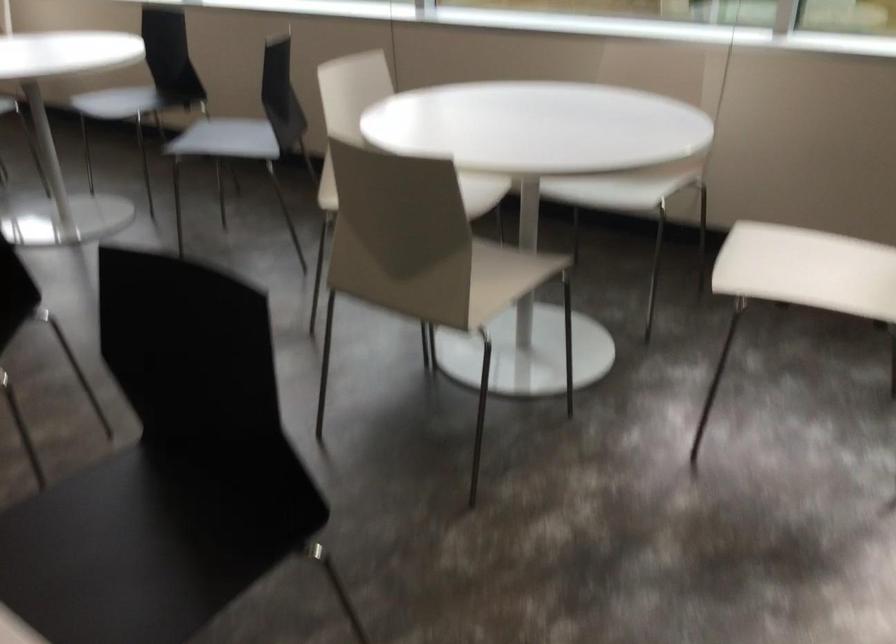
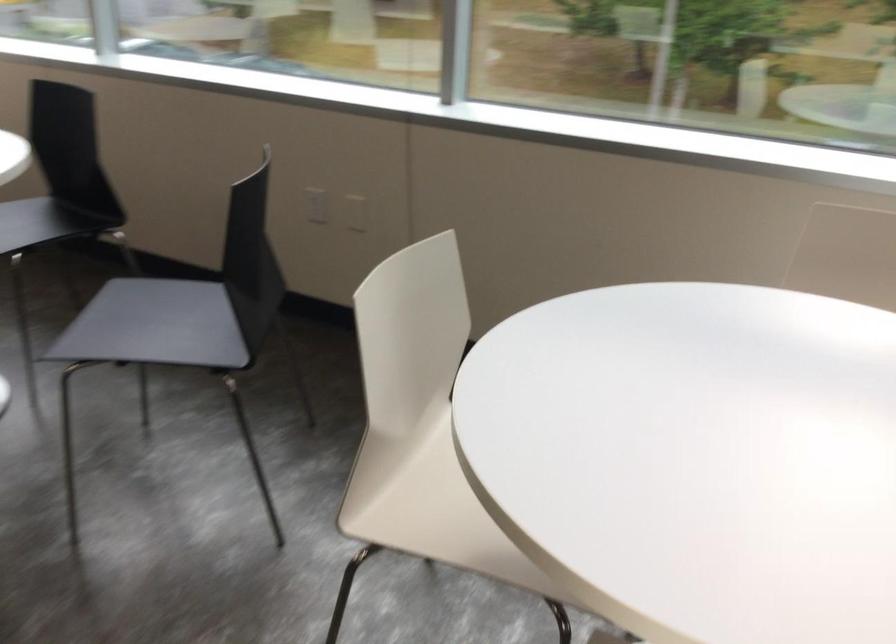
Question: Which direction would the cameraman need to move to produce the second image? Reply with the corresponding letter.

Choices:
 (A) Left
 (B) Right
 (C) Forward
 (D) Backward

Answer: (C)